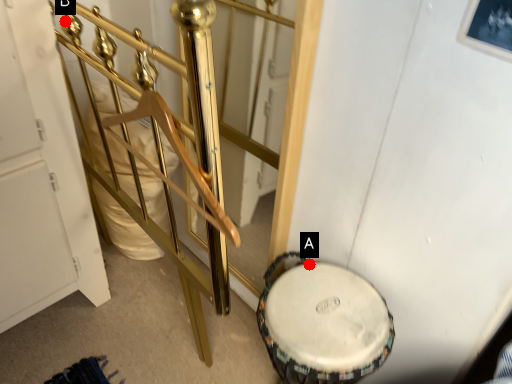
Question: Two points are circled on the image, labeled by A and B beside each circle. Which point is further to the camera?

Choices:
 (A) A is further
 (B) B is further

Answer: (A)